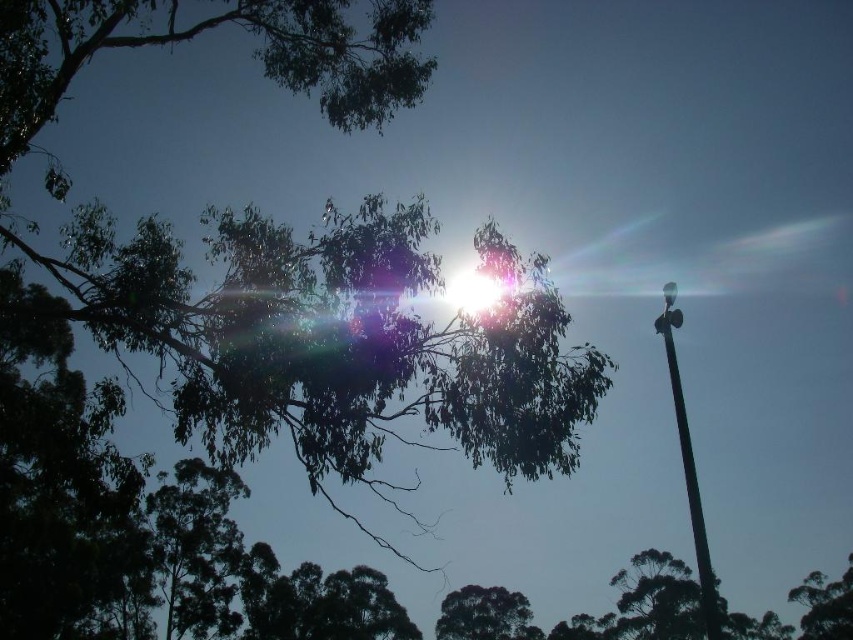
Can you confirm if dark green leafy tree at upper left is positioned above green leafy tree at upper center?

Indeed, dark green leafy tree at upper left is positioned over green leafy tree at upper center.

Between point (171, 8) and point (844, 625), which one is positioned behind?

Positioned behind is point (844, 625).

Locate an element on the screen. The width and height of the screenshot is (853, 640). dark green leafy tree at upper left is located at coordinates (209, 29).

What are the coordinates of `dark green leafy tree at upper left` in the screenshot? It's located at (209, 29).

This screenshot has height=640, width=853. What do you see at coordinates (688, 465) in the screenshot?
I see `metallic pole at right` at bounding box center [688, 465].

Between point (700, 541) and point (830, 588), which one is positioned behind?

Positioned behind is point (830, 588).

What are the coordinates of `metallic pole at right` in the screenshot? It's located at (688, 465).

Which of these two, metallic pole at right or dark green leafy tree at lower center, stands shorter?

dark green leafy tree at lower center

Find the location of `metallic pole at right`. metallic pole at right is located at coordinates (688, 465).

At what (x,y) coordinates should I click in order to perform the action: click on metallic pole at right. Please return your answer as a coordinate pair (x, y). Looking at the image, I should click on (688, 465).